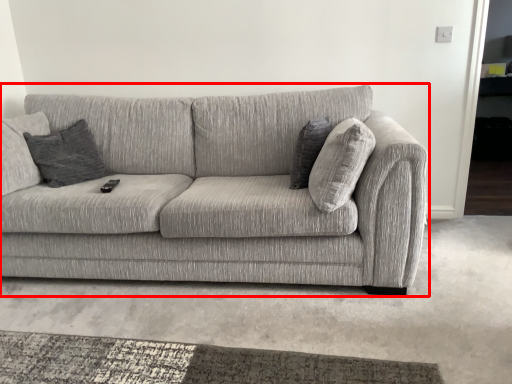
Question: Where is studio couch (annotated by the red box) located in relation to pillow in the image?

Choices:
 (A) left
 (B) right

Answer: (A)